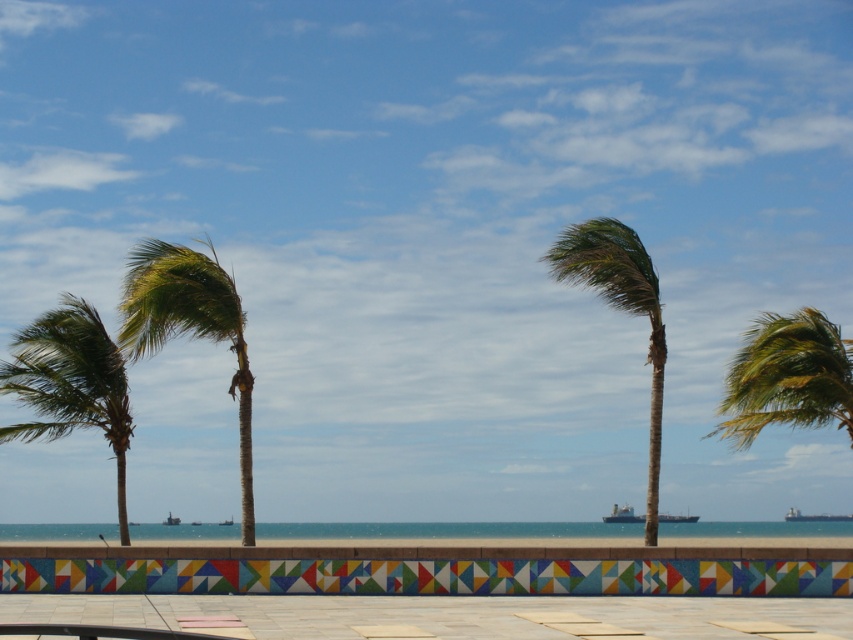
Question: Among these objects, which one is farthest from the camera?

Choices:
 (A) green leafy palm tree at right
 (B) green leafy palm tree at center
 (C) green leafy palm tree at left
 (D) metallic gray ship at lower left

Answer: (D)

Question: Which object is positioned closest to the metallic gray ship at lower right?

Choices:
 (A) green leafy palm tree at left
 (B) green leafy palm at left

Answer: (B)

Question: Where is green leafy palm tree at center located in relation to metallic gray ship at lower right in the image?

Choices:
 (A) below
 (B) above

Answer: (B)

Question: Estimate the real-world distances between objects in this image. Which object is farther from the metallic gray ship at lower left?

Choices:
 (A) blue water at center
 (B) metallic gray ship at center
 (C) green leafy palm tree at center
 (D) green leafy palm tree at right

Answer: (D)

Question: From the image, what is the correct spatial relationship of green leafy palm tree at right in relation to metallic gray ship at center?

Choices:
 (A) above
 (B) below

Answer: (A)

Question: Observing the image, what is the correct spatial positioning of green leafy palm tree at left in reference to metallic gray ship at center?

Choices:
 (A) right
 (B) left

Answer: (B)